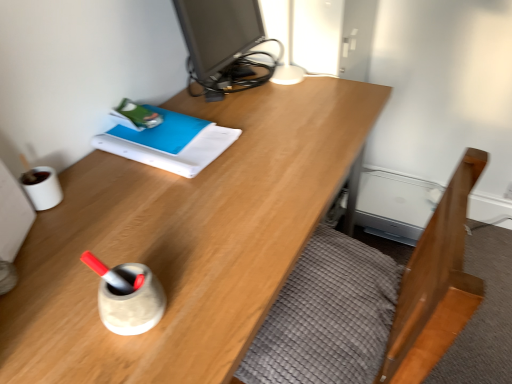
This screenshot has height=384, width=512. Find the location of `free space in front of blue matte book at upper left`. free space in front of blue matte book at upper left is located at coordinates (157, 211).